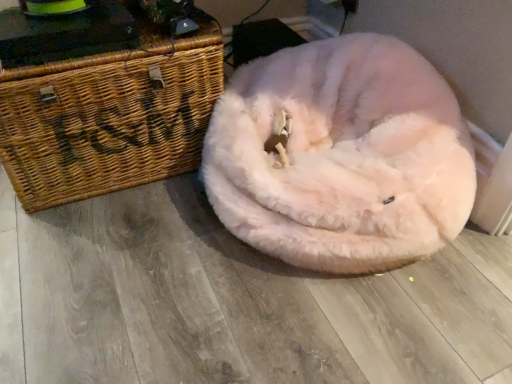
Question: From the image's perspective, would you say woven wood chest at left is positioned over fluffy pink dog bed at center?

Choices:
 (A) no
 (B) yes

Answer: (B)

Question: Can you confirm if woven wood chest at left is positioned to the left of fluffy pink dog bed at center?

Choices:
 (A) yes
 (B) no

Answer: (A)

Question: Is woven wood chest at left closer to camera compared to fluffy pink dog bed at center?

Choices:
 (A) no
 (B) yes

Answer: (A)

Question: From the image's perspective, does woven wood chest at left appear lower than fluffy pink dog bed at center?

Choices:
 (A) yes
 (B) no

Answer: (B)

Question: Is woven wood chest at left shorter than fluffy pink dog bed at center?

Choices:
 (A) no
 (B) yes

Answer: (A)

Question: Is woven wood chest at left positioned with its back to fluffy pink dog bed at center?

Choices:
 (A) yes
 (B) no

Answer: (B)

Question: Considering the relative sizes of fluffy pink dog bed at center and woven wood chest at left in the image provided, is fluffy pink dog bed at center shorter than woven wood chest at left?

Choices:
 (A) no
 (B) yes

Answer: (B)

Question: From the image's perspective, is fluffy pink dog bed at center above woven wood chest at left?

Choices:
 (A) no
 (B) yes

Answer: (A)

Question: Is fluffy pink dog bed at center positioned in front of woven wood chest at left?

Choices:
 (A) yes
 (B) no

Answer: (A)

Question: From a real-world perspective, is fluffy pink dog bed at center on top of woven wood chest at left?

Choices:
 (A) yes
 (B) no

Answer: (B)

Question: Is fluffy pink dog bed at center not inside woven wood chest at left?

Choices:
 (A) yes
 (B) no

Answer: (A)

Question: From the image's perspective, is fluffy pink dog bed at center below woven wood chest at left?

Choices:
 (A) no
 (B) yes

Answer: (B)

Question: Considering their positions, is fluffy pink dog bed at center located in front of or behind woven wood chest at left?

Choices:
 (A) front
 (B) behind

Answer: (A)